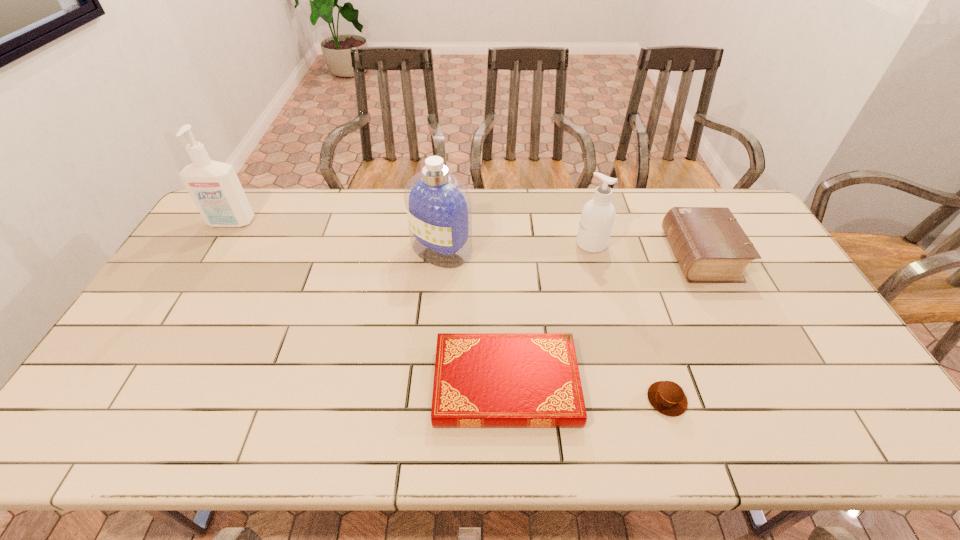
Identify the location of vacant space positioned 0.310m on the front label of the fourth shortest object. (482, 244).

Where is `free space located on the front label of the fourth shortest object`? free space located on the front label of the fourth shortest object is located at coordinates (537, 244).

You are a GUI agent. You are given a task and a screenshot of the screen. Output one action in this format:
    pyautogui.click(x=<x>, y=<y>)
    Task: Click on the free space located 0.240m on the front label of the fourth shortest object
    Image resolution: width=960 pixels, height=540 pixels.
    Given the screenshot: What is the action you would take?
    pyautogui.click(x=503, y=244)

Where is `blank space located 0.280m on the spine side of the fourth tallest object`? The width and height of the screenshot is (960, 540). blank space located 0.280m on the spine side of the fourth tallest object is located at coordinates (582, 255).

At what (x,y) coordinates should I click in order to perform the action: click on vacant space located on the spine side of the fourth tallest object. Please return your answer as a coordinate pair (x, y). The image size is (960, 540). Looking at the image, I should click on (619, 255).

Find the location of a particular element. This screenshot has height=540, width=960. vacant space located on the spine side of the fourth tallest object is located at coordinates (566, 255).

Find the location of a particular element. Image resolution: width=960 pixels, height=540 pixels. free space located 0.200m on the back of the muffin is located at coordinates (641, 319).

This screenshot has height=540, width=960. I want to click on free space located 0.390m on the cover of the hardback book, so click(x=277, y=384).

Where is `vacant space located 0.280m on the cover of the hardback book`? The image size is (960, 540). vacant space located 0.280m on the cover of the hardback book is located at coordinates (323, 384).

Locate an element on the screen. free space located 0.330m on the cover of the hardback book is located at coordinates (302, 384).